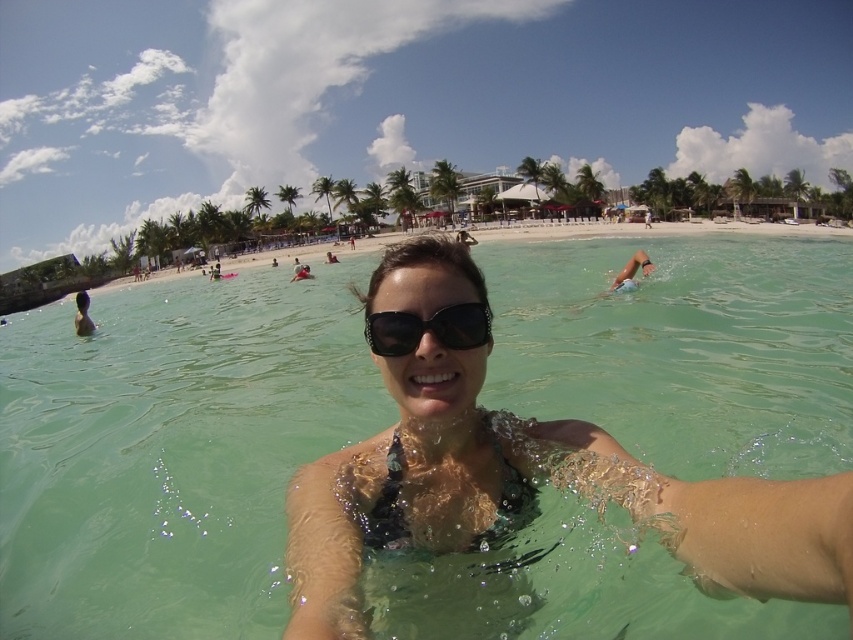
Question: Which of the following is the farthest from the observer?

Choices:
 (A) black rubber goggles at center
 (B) clear water at center

Answer: (A)

Question: Can you confirm if clear water at center is thinner than black rubber goggles at center?

Choices:
 (A) no
 (B) yes

Answer: (A)

Question: Which of the following is the farthest from the observer?

Choices:
 (A) (827, 452)
 (B) (445, 317)

Answer: (A)

Question: Is clear water at center below black rubber goggles at center?

Choices:
 (A) no
 (B) yes

Answer: (A)

Question: Can you confirm if clear water at center is smaller than black rubber goggles at center?

Choices:
 (A) yes
 (B) no

Answer: (B)